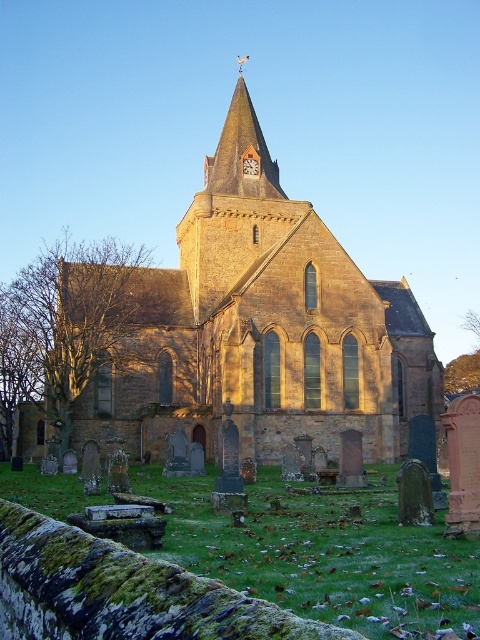
Question: Can you confirm if brown stone spire at upper center is smaller than matte brown clock at center?

Choices:
 (A) no
 (B) yes

Answer: (A)

Question: Is brown stone spire at upper center thinner than matte brown clock at center?

Choices:
 (A) yes
 (B) no

Answer: (B)

Question: Which of the following is the closest to the observer?

Choices:
 (A) brown stone church at center
 (B) brown stone spire at upper center
 (C) matte brown clock at center

Answer: (A)

Question: Does brown stone church at center appear on the left side of matte brown clock at center?

Choices:
 (A) no
 (B) yes

Answer: (B)

Question: Which of the following is the farthest from the observer?

Choices:
 (A) brown stone spire at upper center
 (B) matte brown clock at center
 (C) brown stone church at center

Answer: (B)

Question: Based on their relative distances, which object is nearer to the matte brown clock at center?

Choices:
 (A) brown stone spire at upper center
 (B) brown stone church at center

Answer: (A)